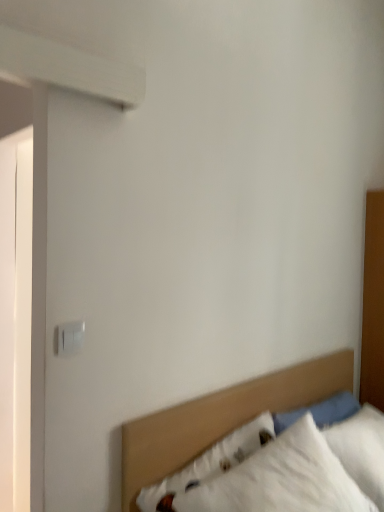
Describe the element at coordinates (70, 337) in the screenshot. The image size is (384, 512). I see `white plastic switch at upper left` at that location.

Locate an element on the screen. The width and height of the screenshot is (384, 512). white plastic switch at upper left is located at coordinates (70, 337).

What do you see at coordinates (221, 418) in the screenshot?
I see `white fabric bed at lower right` at bounding box center [221, 418].

Where is `white fabric bed at lower right`? white fabric bed at lower right is located at coordinates (221, 418).

You are a GUI agent. You are given a task and a screenshot of the screen. Output one action in this format:
    pyautogui.click(x=<x>, y=<y>)
    Task: Click on the white plastic switch at upper left
    This screenshot has width=384, height=512.
    Given the screenshot: What is the action you would take?
    pyautogui.click(x=70, y=337)

Is white plastic switch at upper left to the left or to the right of white fabric bed at lower right in the image?

Clearly, white plastic switch at upper left is on the left of white fabric bed at lower right in the image.

Which is behind, white plastic switch at upper left or white fabric bed at lower right?

white plastic switch at upper left is behind.

Which is behind, point (65, 347) or point (167, 453)?

The point (167, 453) is behind.

From the image's perspective, which is above, white plastic switch at upper left or white fabric bed at lower right?

From the image's view, white plastic switch at upper left is above.

From a real-world perspective, is white plastic switch at upper left physically located above or below white fabric bed at lower right?

white plastic switch at upper left is above white fabric bed at lower right.

In the scene shown: Is white plastic switch at upper left thinner than white fabric bed at lower right?

Yes, white plastic switch at upper left is thinner than white fabric bed at lower right.

Considering the sizes of objects white plastic switch at upper left and white fabric bed at lower right in the image provided, who is taller, white plastic switch at upper left or white fabric bed at lower right?

Standing taller between the two is white fabric bed at lower right.

Which of these two, white plastic switch at upper left or white fabric bed at lower right, is bigger?

Bigger between the two is white fabric bed at lower right.

Would you say white plastic switch at upper left contains white fabric bed at lower right?

Actually, white fabric bed at lower right is outside white plastic switch at upper left.

Would you say white plastic switch at upper left is a long distance from white fabric bed at lower right?

No, white plastic switch at upper left is in close proximity to white fabric bed at lower right.

Is white plastic switch at upper left aimed at white fabric bed at lower right?

No.

You are a GUI agent. You are given a task and a screenshot of the screen. Output one action in this format:
    pyautogui.click(x=<x>, y=<y>)
    Task: Click on the electric outlet above the white fabric bed at lower right (from the image's perspective)
    Image resolution: width=384 pixels, height=512 pixels.
    Given the screenshot: What is the action you would take?
    pyautogui.click(x=70, y=337)

Between white fabric bed at lower right and white plastic switch at upper left, which one appears on the right side from the viewer's perspective?

white fabric bed at lower right.

Which object is more forward, white fabric bed at lower right or white plastic switch at upper left?

Positioned in front is white fabric bed at lower right.

Considering the points (246, 394) and (69, 349), which point is behind, point (246, 394) or point (69, 349)?

The point (246, 394) is farther.

From the image's perspective, relative to white plastic switch at upper left, is white fabric bed at lower right above or below?

white fabric bed at lower right is below white plastic switch at upper left.

From a real-world perspective, is white fabric bed at lower right located higher than white plastic switch at upper left?

No, from a real-world perspective, white fabric bed at lower right is not on top of white plastic switch at upper left.

Considering the sizes of objects white fabric bed at lower right and white plastic switch at upper left in the image provided, who is thinner, white fabric bed at lower right or white plastic switch at upper left?

Thinner between the two is white plastic switch at upper left.

Considering the relative sizes of white fabric bed at lower right and white plastic switch at upper left in the image provided, is white fabric bed at lower right taller than white plastic switch at upper left?

Indeed, white fabric bed at lower right has a greater height compared to white plastic switch at upper left.

Does white fabric bed at lower right have a smaller size compared to white plastic switch at upper left?

Actually, white fabric bed at lower right might be larger than white plastic switch at upper left.

Would you say white fabric bed at lower right contains white plastic switch at upper left?

No, white plastic switch at upper left is located outside of white fabric bed at lower right.

Consider the image. Are white fabric bed at lower right and white plastic switch at upper left far apart?

No, white fabric bed at lower right is not far from white plastic switch at upper left.

Is white fabric bed at lower right oriented away from white plastic switch at upper left?

white fabric bed at lower right does not have its back to white plastic switch at upper left.

Find the location of a particular element. Image resolution: width=384 pixels, height=512 pixels. bed located underneath the white plastic switch at upper left (from a real-world perspective) is located at coordinates (221, 418).

At what (x,y) coordinates should I click in order to perform the action: click on bed below the white plastic switch at upper left (from the image's perspective). Please return your answer as a coordinate pair (x, y). Image resolution: width=384 pixels, height=512 pixels. Looking at the image, I should click on (221, 418).

In order to click on electric outlet that appears on the left of white fabric bed at lower right in this screenshot , I will do `click(70, 337)`.